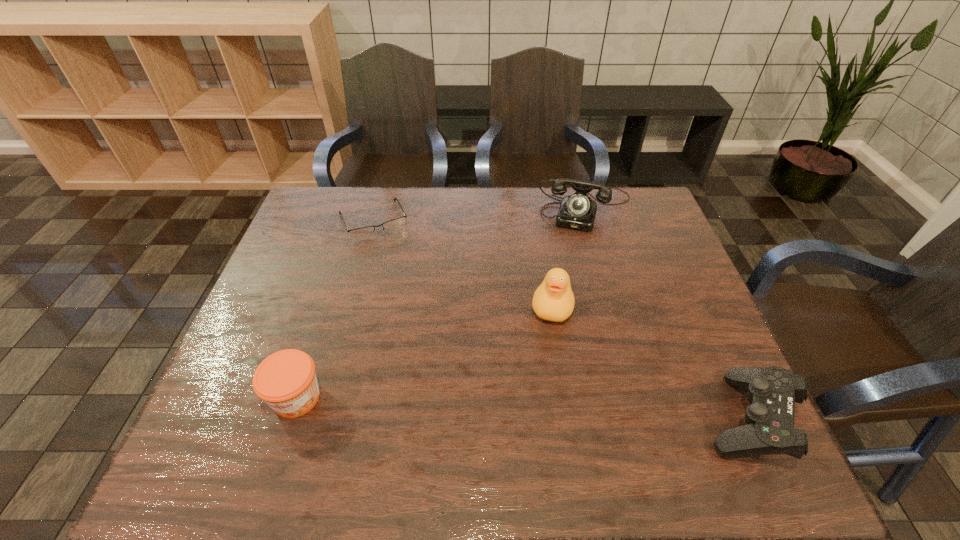
I want to click on vacant space located 0.180m on the face of the duck, so click(x=538, y=389).

At what (x,y) coordinates should I click in order to perform the action: click on vacant area located on the face of the duck. Please return your answer as a coordinate pair (x, y). The image size is (960, 540). Looking at the image, I should click on (535, 405).

The height and width of the screenshot is (540, 960). Identify the location of vacant space situated on the face of the duck. (545, 349).

At what (x,y) coordinates should I click in order to perform the action: click on free space located on the front-facing side of the telephone. Please return your answer as a coordinate pair (x, y). This screenshot has width=960, height=540. Looking at the image, I should click on (575, 241).

Identify the location of vacant space located 0.280m on the front-facing side of the telephone. (563, 295).

Find the location of a particular element. The width and height of the screenshot is (960, 540). vacant space located 0.270m on the front-facing side of the telephone is located at coordinates (563, 293).

In order to click on spectacles at the far edge in this screenshot , I will do `click(393, 225)`.

Where is `telephone at the far edge`? Image resolution: width=960 pixels, height=540 pixels. telephone at the far edge is located at coordinates (577, 211).

The image size is (960, 540). In order to click on jam situated at the near edge in this screenshot , I will do `click(286, 380)`.

The width and height of the screenshot is (960, 540). Identify the location of control that is positioned at the near edge. (769, 429).